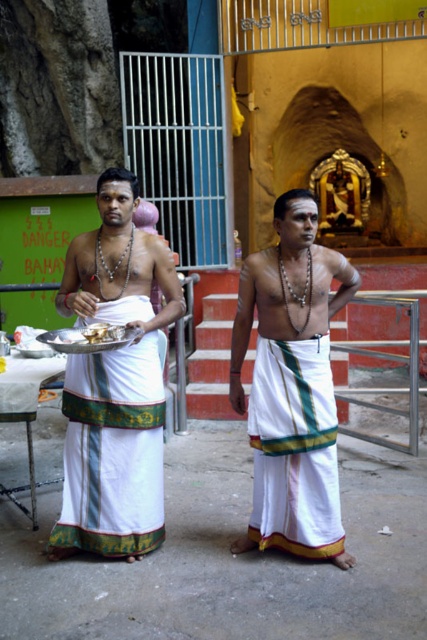
Is white clothed man at left taller than white clothed man at center?

Yes, white clothed man at left is taller than white clothed man at center.

Between white clothed man at left and white clothed man at center, which one has more height?

white clothed man at left

Does point (117, 364) come farther from viewer compared to point (257, 253)?

Yes, it is.

Identify the location of white clothed man at left. The height and width of the screenshot is (640, 427). (114, 384).

Which is above, white clothed man at left or white cotton dhoti at center?

white clothed man at left is higher up.

Measure the distance from white clothed man at left to white cotton dhoti at center.

64.21 centimeters

Where is `white clothed man at left`? This screenshot has width=427, height=640. white clothed man at left is located at coordinates (114, 384).

This screenshot has width=427, height=640. I want to click on white clothed man at left, so click(x=114, y=384).

Is white clothed man at center bigger than white cotton dhoti at center?

Indeed, white clothed man at center has a larger size compared to white cotton dhoti at center.

The height and width of the screenshot is (640, 427). Find the location of `white clothed man at center`. white clothed man at center is located at coordinates (294, 384).